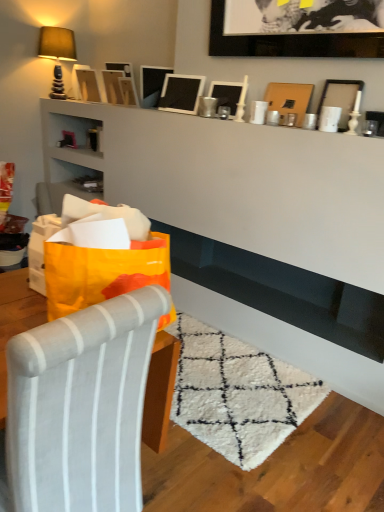
What do you see at coordinates (297, 28) in the screenshot?
I see `black matte picture frame at upper center, the seventh picture frame in the left-to-right sequence` at bounding box center [297, 28].

What is the approximate height of matte beige fabric at upper left?

57.11 centimeters.

Identify the location of wooden picture frame at upper center, the seventh picture frame in the right-to-left sequence. The height and width of the screenshot is (512, 384). (113, 86).

I want to click on matte black picture frame at upper center, the 5th picture frame in the right-to-left sequence, so click(152, 85).

At what (x,y) coordinates should I click in order to perform the action: click on matte black picture frame at upper left, which ranks as the eighth picture frame in right-to-left order. Please return your answer as a coordinate pair (x, y). The image size is (384, 512). Looking at the image, I should click on (88, 85).

This screenshot has width=384, height=512. What are the coordinates of `black matte picture frame at upper center, the seventh picture frame in the left-to-right sequence` in the screenshot? It's located at pyautogui.click(x=297, y=28).

Is matte brown picture frame at upper right, acting as the eighth picture frame starting from the left, looking in the opposite direction of wooden picture frame at upper center, the 2th picture frame from the left?

No.

Would you say matte brown picture frame at upper right, acting as the eighth picture frame starting from the left, is to the left or to the right of wooden picture frame at upper center, the 2th picture frame from the left, in the picture?

matte brown picture frame at upper right, acting as the eighth picture frame starting from the left, is to the right of wooden picture frame at upper center, the 2th picture frame from the left.

Is matte brown picture frame at upper right, arranged as the 1th picture frame when viewed from the right, positioned behind wooden picture frame at upper center, the 2th picture frame from the left?

No, it is not.

Does point (342, 89) come behind point (108, 93)?

No.

Starting from the matte black picture frame at upper center, acting as the 4th picture frame starting from the left, which picture frame is the 2nd one to the left? Please provide its 2D coordinates.

[(113, 86)]

Could you tell me if matte black picture frame at upper center, acting as the 4th picture frame starting from the left, is turned towards wooden picture frame at upper center, the 2th picture frame from the left?

No, matte black picture frame at upper center, acting as the 4th picture frame starting from the left, does not turn towards wooden picture frame at upper center, the 2th picture frame from the left.

Is matte black picture frame at upper center, the 5th picture frame in the right-to-left sequence, in front of or behind wooden picture frame at upper center, the seventh picture frame in the right-to-left sequence, in the image?

Clearly, matte black picture frame at upper center, the 5th picture frame in the right-to-left sequence, is in front of wooden picture frame at upper center, the seventh picture frame in the right-to-left sequence.

Considering the positions of points (163, 71) and (109, 102), is point (163, 71) closer to camera compared to point (109, 102)?

Yes, it is.

Is orange paper bag at left taller or shorter than matte brown picture frame at upper right, arranged as the 1th picture frame when viewed from the right?

Clearly, orange paper bag at left is taller compared to matte brown picture frame at upper right, arranged as the 1th picture frame when viewed from the right.

How many degrees apart are the facing directions of orange paper bag at left and matte brown picture frame at upper right, acting as the eighth picture frame starting from the left?

85.2 degrees.

Is orange paper bag at left smaller than matte brown picture frame at upper right, arranged as the 1th picture frame when viewed from the right?

Incorrect, orange paper bag at left is not smaller in size than matte brown picture frame at upper right, arranged as the 1th picture frame when viewed from the right.

From the image's perspective, which is below, orange paper bag at left or matte brown picture frame at upper right, acting as the eighth picture frame starting from the left?

From the image's view, orange paper bag at left is below.

Is matte black picture frame at upper center, which is the 5th picture frame in left-to-right order, shorter than matte beige fabric at upper left?

Yes, matte black picture frame at upper center, which is the 5th picture frame in left-to-right order, is shorter than matte beige fabric at upper left.

From the image's perspective, which is below, matte black picture frame at upper center, acting as the fourth picture frame starting from the right, or matte beige fabric at upper left?

matte black picture frame at upper center, acting as the fourth picture frame starting from the right, is shown below in the image.

Between matte black picture frame at upper center, which is the 5th picture frame in left-to-right order, and matte beige fabric at upper left, which one appears on the right side from the viewer's perspective?

Positioned to the right is matte black picture frame at upper center, which is the 5th picture frame in left-to-right order.

Is point (189, 113) positioned behind point (41, 53)?

No, it is in front of (41, 53).

From the image's perspective, is matte beige fabric at upper left under matte black picture frame at upper center, acting as the fourth picture frame starting from the right?

Actually, matte beige fabric at upper left appears above matte black picture frame at upper center, acting as the fourth picture frame starting from the right, in the image.

Is matte beige fabric at upper left at the left side of matte black picture frame at upper center, acting as the fourth picture frame starting from the right?

Indeed, matte beige fabric at upper left is positioned on the left side of matte black picture frame at upper center, acting as the fourth picture frame starting from the right.

Looking at their sizes, would you say matte beige fabric at upper left is wider or thinner than matte black picture frame at upper center, which is the 5th picture frame in left-to-right order?

In the image, matte beige fabric at upper left appears to be wider than matte black picture frame at upper center, which is the 5th picture frame in left-to-right order.

Which is behind, matte beige fabric at upper left or matte black picture frame at upper center, which is the 5th picture frame in left-to-right order?

matte beige fabric at upper left.

Does wooden picture frame at upper center, the third picture frame when ordered from left to right, have a lesser height compared to matte beige fabric at upper left?

Indeed, wooden picture frame at upper center, the third picture frame when ordered from left to right, has a lesser height compared to matte beige fabric at upper left.

Would you consider wooden picture frame at upper center, the 6th picture frame viewed from the right, to be distant from matte beige fabric at upper left?

No, wooden picture frame at upper center, the 6th picture frame viewed from the right, is in close proximity to matte beige fabric at upper left.

Is point (131, 78) closer to camera compared to point (55, 35)?

That is False.

I want to click on table lamp above the wooden picture frame at upper center, the third picture frame when ordered from left to right (from the image's perspective), so click(x=57, y=54).

Considering the sizes of objects metallic silver picture frame at upper center, positioned as the 3th picture frame in right-to-left order, and matte brown picture frame at upper right, acting as the eighth picture frame starting from the left, in the image provided, who is taller, metallic silver picture frame at upper center, positioned as the 3th picture frame in right-to-left order, or matte brown picture frame at upper right, acting as the eighth picture frame starting from the left,?

Standing taller between the two is matte brown picture frame at upper right, acting as the eighth picture frame starting from the left.

Locate an element on the screen. Image resolution: width=384 pixels, height=512 pixels. picture frame that is the 2nd object to the right of the metallic silver picture frame at upper center, positioned as the 3th picture frame in right-to-left order, starting at the anchor is located at coordinates (340, 98).

Which object is further away from the camera, metallic silver picture frame at upper center, positioned as the 3th picture frame in right-to-left order, or matte brown picture frame at upper right, acting as the eighth picture frame starting from the left?

metallic silver picture frame at upper center, positioned as the 3th picture frame in right-to-left order, is further away from the camera.

In order to click on picture frame that is the 6th object to the right of the wooden picture frame at upper center, the seventh picture frame in the right-to-left sequence, starting at the anchor in this screenshot , I will do (340, 98).

Find the location of a particular element. The image size is (384, 512). the 1st picture frame behind when counting from the matte black picture frame at upper center, the 5th picture frame in the right-to-left sequence is located at coordinates (113, 86).

From the image, which object appears to be farther from matte black picture frame at upper left, which is the 1th picture frame in left-to-right order, wooden picture frame at upper center, the 6th picture frame viewed from the right, or matte beige fabric at upper left?

Based on the image, wooden picture frame at upper center, the 6th picture frame viewed from the right, appears to be further to matte black picture frame at upper left, which is the 1th picture frame in left-to-right order.

Considering their positions, is matte brown picture frame at upper right, acting as the eighth picture frame starting from the left, positioned further to matte black picture frame at upper center, acting as the 4th picture frame starting from the left, than orange paper bag at left?

The object further to matte black picture frame at upper center, acting as the 4th picture frame starting from the left, is orange paper bag at left.

Which object lies nearer to the anchor point wooden picture frame at upper center, the 2th picture frame from the left, matte black picture frame at upper left, which is the 1th picture frame in left-to-right order, or matte brown picture frame at upper right, arranged as the 1th picture frame when viewed from the right?

matte black picture frame at upper left, which is the 1th picture frame in left-to-right order, is closer to wooden picture frame at upper center, the 2th picture frame from the left.

Considering their positions, is matte black picture frame at upper center, the 5th picture frame in the right-to-left sequence, positioned closer to matte black picture frame at upper left, which is the 1th picture frame in left-to-right order, than wooden picture frame at upper center, the third picture frame when ordered from left to right?

The object closer to matte black picture frame at upper left, which is the 1th picture frame in left-to-right order, is wooden picture frame at upper center, the third picture frame when ordered from left to right.

Based on their spatial positions, is matte beige fabric at upper left or matte black picture frame at upper left, which is the 1th picture frame in left-to-right order, further from wooden picture frame at upper center, the 6th picture frame viewed from the right?

The object further to wooden picture frame at upper center, the 6th picture frame viewed from the right, is matte beige fabric at upper left.

Based on their spatial positions, is wooden picture frame at upper center, the seventh picture frame in the right-to-left sequence, or matte black picture frame at upper center, which is the 5th picture frame in left-to-right order, closer to wooden picture frame at upper center, the 6th picture frame viewed from the right?

wooden picture frame at upper center, the seventh picture frame in the right-to-left sequence.

Based on their spatial positions, is wooden picture frame at upper center, the third picture frame when ordered from left to right, or matte brown picture frame at upper right, arranged as the 1th picture frame when viewed from the right, further from wooden picture frame at upper center, the seventh picture frame in the right-to-left sequence?

The object further to wooden picture frame at upper center, the seventh picture frame in the right-to-left sequence, is matte brown picture frame at upper right, arranged as the 1th picture frame when viewed from the right.

Estimate the real-world distances between objects in this image. Which object is closer to matte black picture frame at upper center, which is the 5th picture frame in left-to-right order, matte beige fabric at upper left or wooden picture frame at upper center, the seventh picture frame in the right-to-left sequence?

wooden picture frame at upper center, the seventh picture frame in the right-to-left sequence.

Locate an element on the screen. picture frame between wooden picture frame at upper center, the third picture frame when ordered from left to right, and matte black picture frame at upper center, which is the 5th picture frame in left-to-right order is located at coordinates (152, 85).

The height and width of the screenshot is (512, 384). Find the location of `picture frame between matte black picture frame at upper left, which is the 1th picture frame in left-to-right order, and wooden picture frame at upper center, the third picture frame when ordered from left to right, in the horizontal direction`. picture frame between matte black picture frame at upper left, which is the 1th picture frame in left-to-right order, and wooden picture frame at upper center, the third picture frame when ordered from left to right, in the horizontal direction is located at coordinates (113, 86).

Find the location of `picture frame between matte beige fabric at upper left and wooden picture frame at upper center, the 2th picture frame from the left`. picture frame between matte beige fabric at upper left and wooden picture frame at upper center, the 2th picture frame from the left is located at coordinates (88, 85).

At what (x,y) coordinates should I click in order to perform the action: click on picture frame between wooden picture frame at upper center, the seventh picture frame in the right-to-left sequence, and matte black picture frame at upper center, the 5th picture frame in the right-to-left sequence, from left to right. Please return your answer as a coordinate pair (x, y). Looking at the image, I should click on (128, 91).